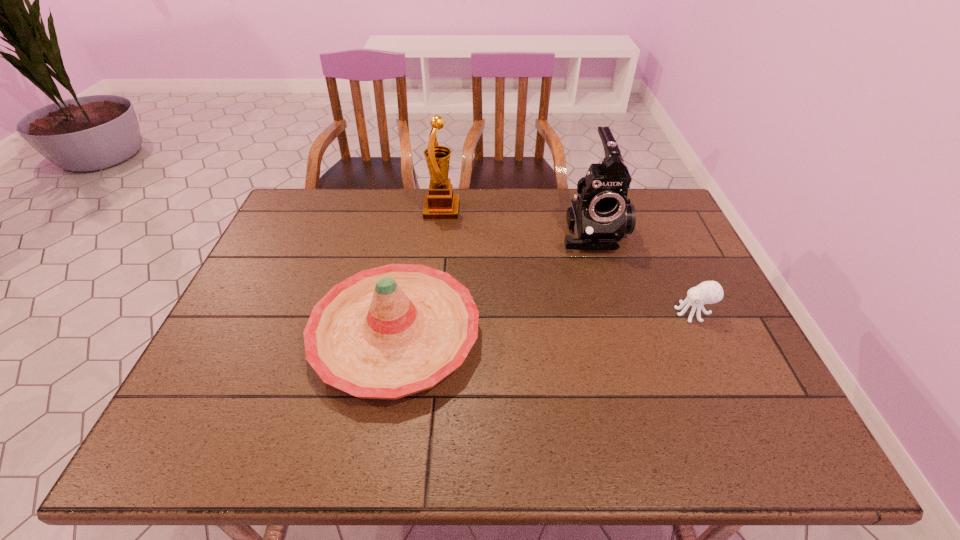
You are a GUI agent. You are given a task and a screenshot of the screen. Output one action in this format:
    pyautogui.click(x=<x>, y=<y>)
    Task: Click on the award
    Image resolution: width=960 pixels, height=540 pixels.
    Given the screenshot: What is the action you would take?
    pyautogui.click(x=440, y=203)

Locate an element on the screen. camcorder is located at coordinates (599, 216).

Find the location of a particular element. Image resolution: width=960 pixels, height=540 pixels. sombrero is located at coordinates (388, 332).

This screenshot has width=960, height=540. In order to click on the shortest object in this screenshot , I will do `click(708, 292)`.

Where is `octopus`? octopus is located at coordinates pyautogui.click(x=708, y=292).

The height and width of the screenshot is (540, 960). Find the location of `vacant region located 0.330m on the front-facing side of the award`. vacant region located 0.330m on the front-facing side of the award is located at coordinates (557, 210).

Locate an element on the screen. The height and width of the screenshot is (540, 960). vacant point located on the lens mount of the third object from left to right is located at coordinates (613, 303).

Identify the location of vacant position located 0.190m on the right of the third tallest object. This screenshot has height=540, width=960. (555, 335).

Find the location of a particular element. free space located 0.370m on the front-facing side of the shortest object is located at coordinates (533, 313).

Where is `free space located 0.070m on the front-facing side of the shortest object`? free space located 0.070m on the front-facing side of the shortest object is located at coordinates (648, 313).